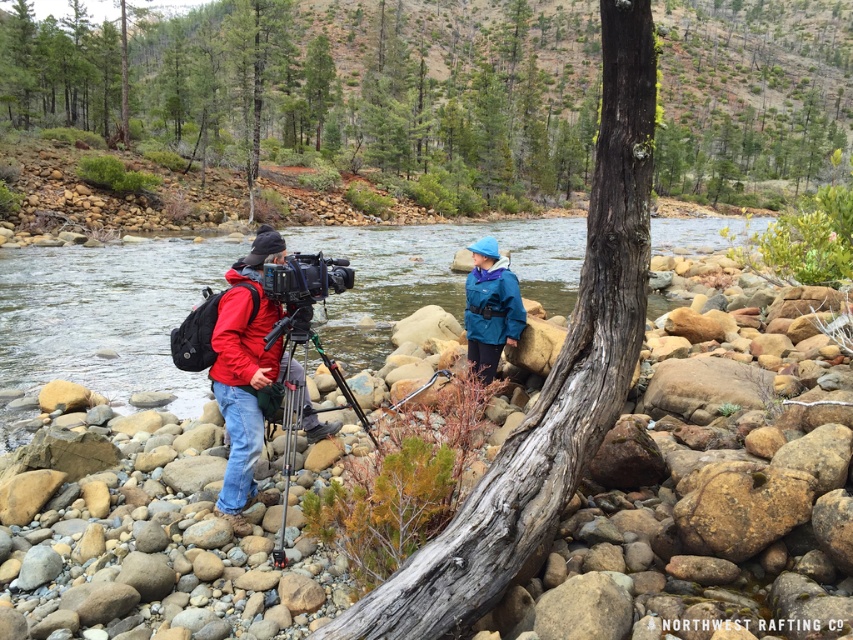
The width and height of the screenshot is (853, 640). Describe the element at coordinates (105, 316) in the screenshot. I see `clear water at stream left` at that location.

Consider the image. Which is more to the right, clear water at stream left or silver metallic tripod at center?

Positioned to the right is clear water at stream left.

Is point (193, 262) in front of point (296, 320)?

No, (193, 262) is further to viewer.

Where is `clear water at stream left`? This screenshot has width=853, height=640. clear water at stream left is located at coordinates (105, 316).

Which is more to the left, clear water at stream left or matte red jacket at left?

matte red jacket at left

Is point (579, 243) in front of point (234, 346)?

No, it is behind (234, 346).

Locate an element on the screen. The height and width of the screenshot is (640, 853). clear water at stream left is located at coordinates (105, 316).

Which is above, teal waterproof jacket at center or silver metallic tripod at center?

Positioned higher is teal waterproof jacket at center.

Is teal waterproof jacket at center shorter than silver metallic tripod at center?

Yes.

Does point (505, 268) come behind point (281, 554)?

Yes, point (505, 268) is behind point (281, 554).

Find the location of `teal waterproof jacket at center`. teal waterproof jacket at center is located at coordinates (490, 307).